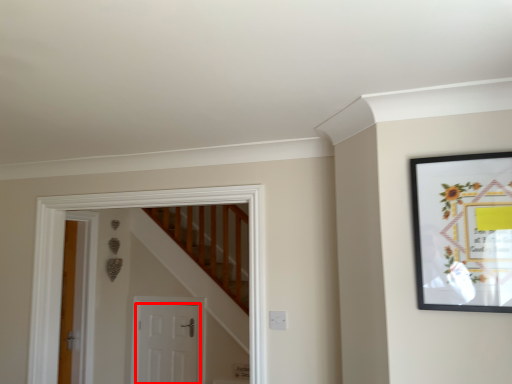
Question: From the image's perspective, what is the correct spatial relationship of door (annotated by the red box) in relation to picture frame?

Choices:
 (A) below
 (B) above

Answer: (A)